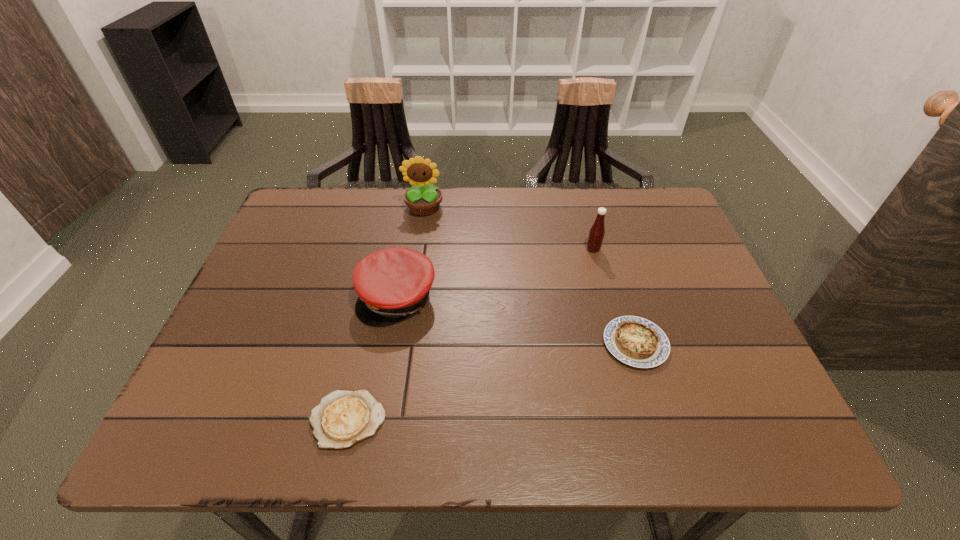
Where is `free location located on the right of the second farthest object`? free location located on the right of the second farthest object is located at coordinates (683, 249).

You are a GUI agent. You are given a task and a screenshot of the screen. Output one action in this format:
    pyautogui.click(x=<x>, y=<y>)
    Task: Click on the vacant space situated on the front-facing side of the third tallest object
    The width and height of the screenshot is (960, 540).
    Given the screenshot: What is the action you would take?
    click(x=375, y=419)

You are a GUI agent. You are given a task and a screenshot of the screen. Output one action in this format:
    pyautogui.click(x=<x>, y=<y>)
    Task: Click on the vacant space located on the left of the right quiche
    The height and width of the screenshot is (540, 960).
    Given the screenshot: What is the action you would take?
    pyautogui.click(x=475, y=343)

The width and height of the screenshot is (960, 540). In order to click on vacant space situated on the right of the left quiche in this screenshot , I will do `click(522, 420)`.

Where is `object that is at the far edge`? The width and height of the screenshot is (960, 540). object that is at the far edge is located at coordinates (423, 199).

Where is `object that is positioned at the near edge`? The image size is (960, 540). object that is positioned at the near edge is located at coordinates (343, 418).

I want to click on object that is at the right edge, so click(635, 341).

Image resolution: width=960 pixels, height=540 pixels. Find the location of `free space at the far edge of the desktop`. free space at the far edge of the desktop is located at coordinates (403, 201).

This screenshot has width=960, height=540. I want to click on vacant space at the near edge of the desktop, so click(x=462, y=431).

I want to click on vacant space at the left edge of the desktop, so click(322, 269).